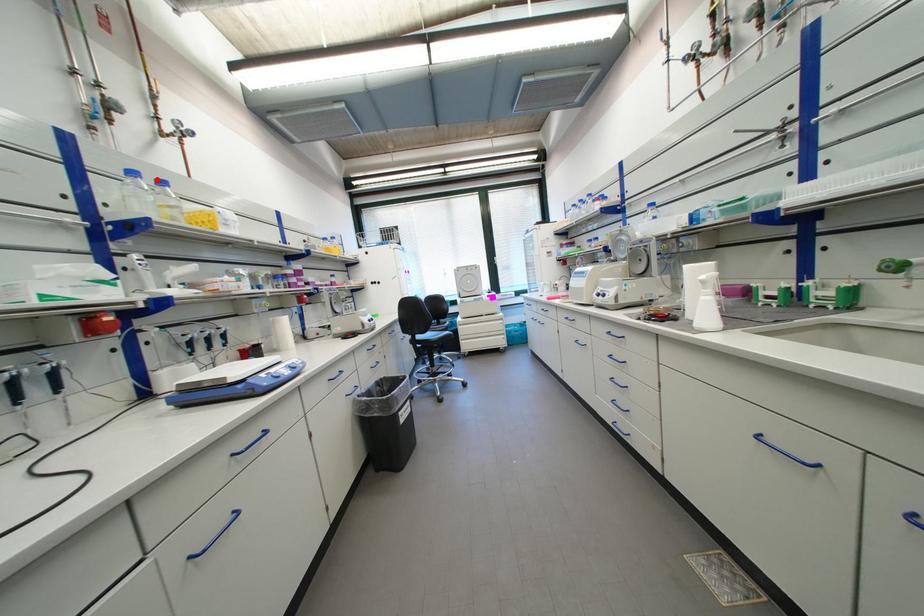
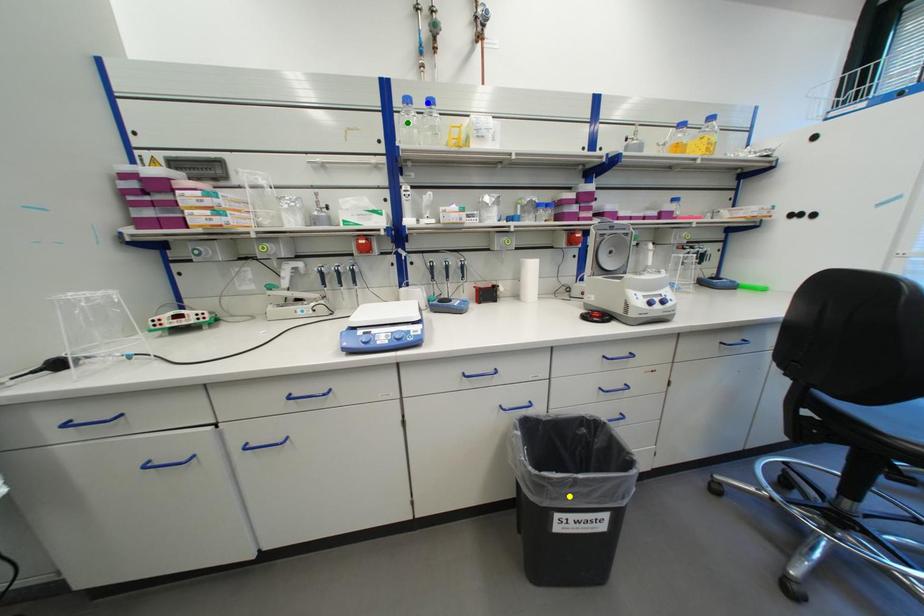
Question: I am providing you with two images of the same scene from different viewpoints. A red point is marked on the first image. You are given multiple points on the second image. In image 2, which mark is for the same physical point as the one in image 1?

Choices:
 (A) yellow point
 (B) green point
 (C) blue point

Answer: (C)